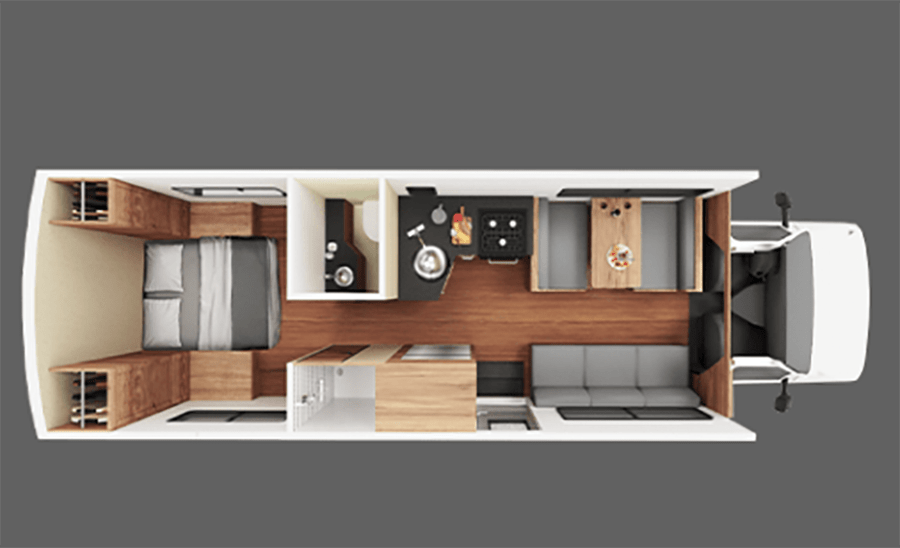
Where is `bed`? The image size is (900, 548). bed is located at coordinates coord(190,299).